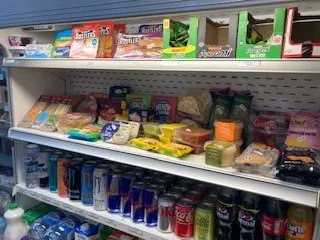
You are a GUI agent. You are given a task and a screenshot of the screen. Output one action in this format:
    pyautogui.click(x=<x>, y=<y>)
    Task: Click on the wall
    The height and width of the screenshot is (240, 320).
    Given the screenshot: What is the action you would take?
    pyautogui.click(x=293, y=89), pyautogui.click(x=34, y=11)